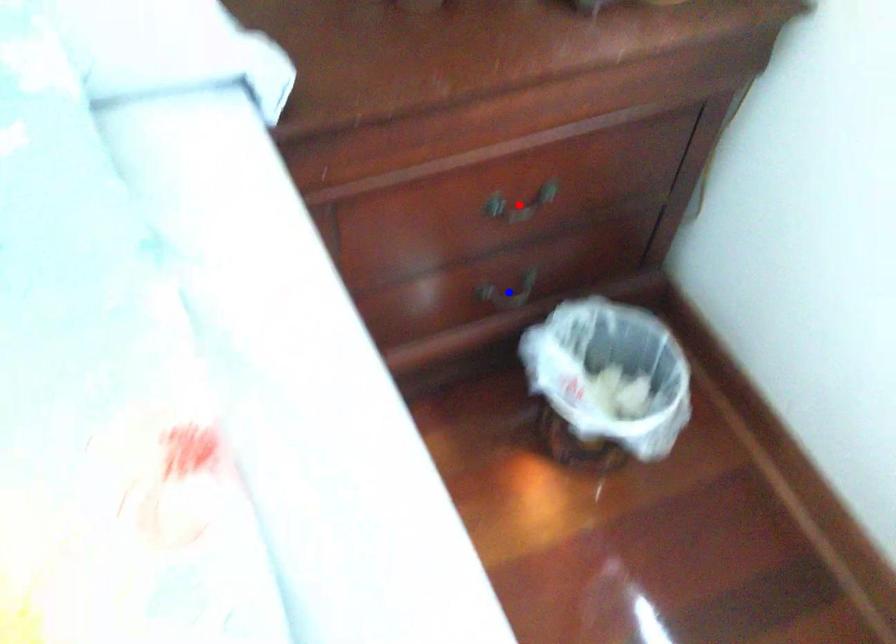
Question: Two points are marked on the image. Which point is closer to the camera?

Choices:
 (A) Blue point is closer.
 (B) Red point is closer.

Answer: (B)